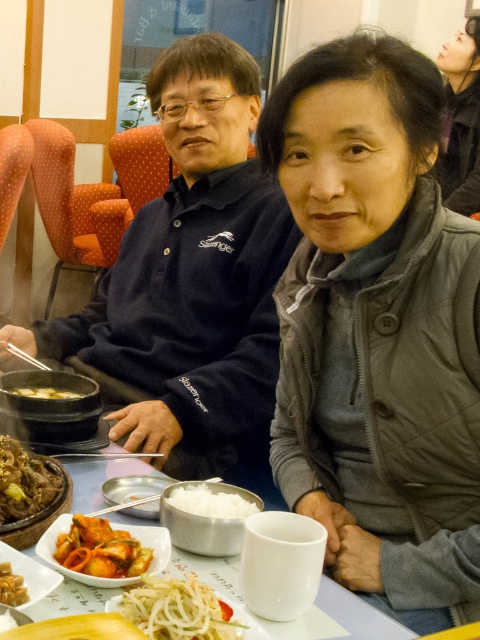
You are a delivery person who needs to place a small package between the matte gray jacket at upper center and the metallic silver chopsticks at center. The package is 1.5 meters long. Can you fit it between them without moving either object?

The distance between the matte gray jacket at upper center and the metallic silver chopsticks at center is 2.68 meters. Since the package is 1.5 meters long, it can fit between them as there is enough space.

You are a server in a restaurant and need to place a new plate between the matte gray jacket at upper center and the metallic silver chopsticks at center. Can you fit the plate there without moving either object?

The matte gray jacket at upper center might be wider than metallic silver chopsticks at center, so there may not be enough space to place the plate between them without moving either object.

You are a delivery person who needs to place a small package on the table between the navy blue polo shirt at center and the white plastic chopsticks at lower center. Can the package fit in the space between them?

The distance between the navy blue polo shirt at center and the white plastic chopsticks at lower center is 73.47 centimeters, so the package can fit in the space between them as long as its dimensions are smaller than or equal to that distance.